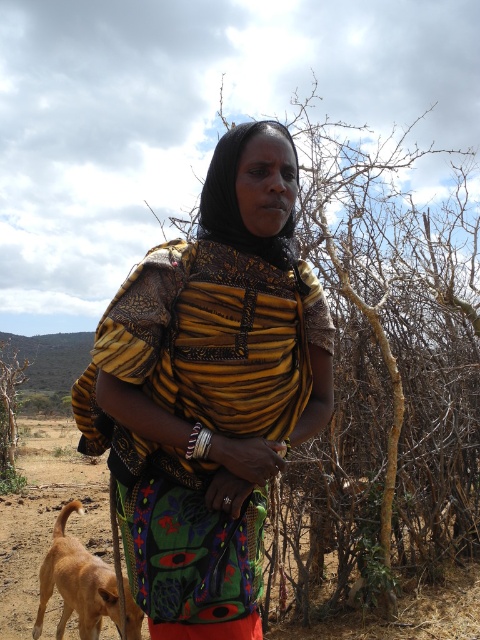
You are a fashion designer observing the woman in the scene. You need to determine which of the two items, the yellow textured fabric at center or the light brown fur at lower left, has a wider width. Which one is wider?

The light brown fur at lower left is wider than the yellow textured fabric at center because the yellow textured fabric at center has a smaller width.

You are a photographer trying to capture the woman in the scene. You notice the yellow textured fabric at center and the light brown fur at lower left. Which object should you focus on if you want to highlight the one that is on the right side of the other?

The yellow textured fabric at center should be focused on because it is positioned on the right side of the light brown fur at lower left.

You are a fashion designer looking at the image of a woman in a rural area. You notice the yellow textured fabric at center. Can you tell me the exact coordinates where this fabric is located?

The yellow textured fabric at center is located at point (210, 390).